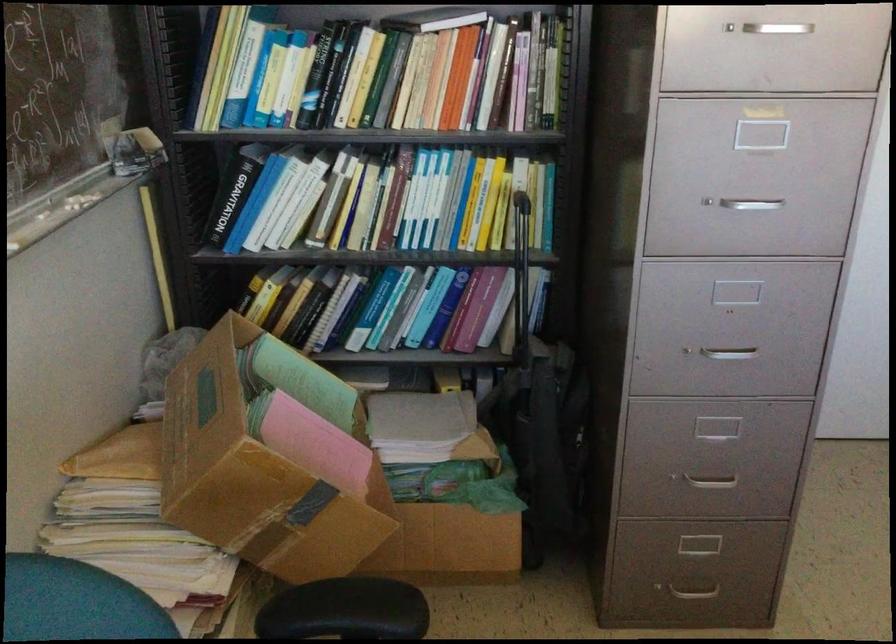
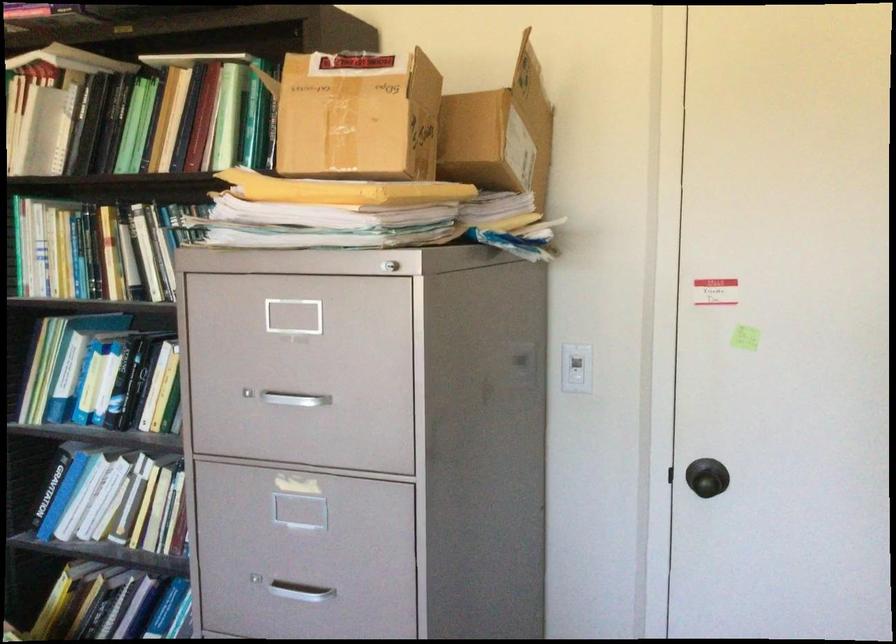
Where in the second image is the point corresponding to (719,209) from the first image?

(300, 592)